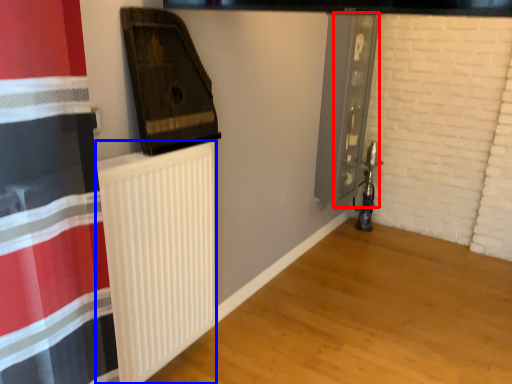
Question: Which point is closer to the camera, screen door (highlighted by a red box) or radiator (highlighted by a blue box)?

Choices:
 (A) screen door
 (B) radiator

Answer: (B)